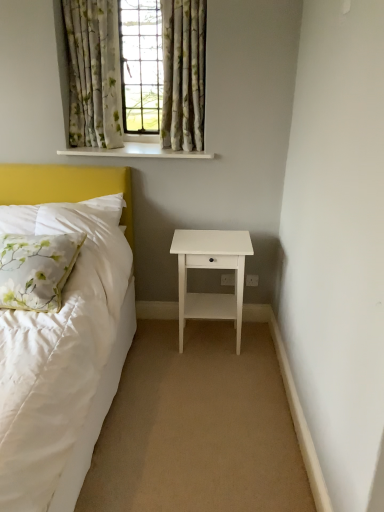
Question: From a real-world perspective, relative to white glossy window sill at upper center, is white glossy nightstand at lower right vertically above or below?

Choices:
 (A) above
 (B) below

Answer: (B)

Question: Relative to white glossy window sill at upper center, is white glossy nightstand at lower right in front or behind?

Choices:
 (A) front
 (B) behind

Answer: (A)

Question: Considering the real-world distances, which object is closest to the white glossy window sill at upper center?

Choices:
 (A) floral fabric curtains at upper center, which is counted as the 2th curtain, starting from the right
 (B) floral fabric curtain at upper center
 (C) white floral fabric pillow at left
 (D) beige carpet at lower center
 (E) floral fabric curtains at upper center, which appears as the 1th curtain when viewed from the right

Answer: (B)

Question: Which object is positioned farthest from the floral fabric curtains at upper center, which appears as the 1th curtain when viewed from the right?

Choices:
 (A) beige carpet at lower center
 (B) floral fabric curtain at upper center
 (C) white floral fabric pillow at left
 (D) floral fabric curtains at upper center, which is counted as the 2th curtain, starting from the right
 (E) white glossy window sill at upper center

Answer: (A)